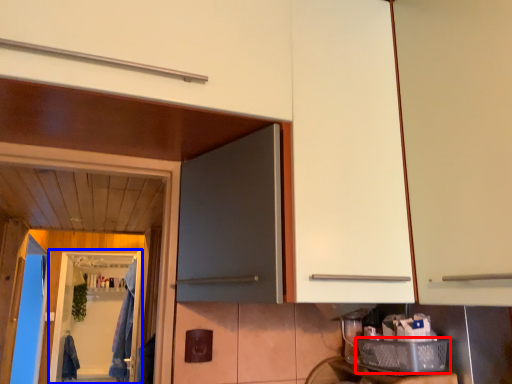
Question: Which object appears farthest to the camera in this image, basket (highlighted by a red box) or screen door (highlighted by a blue box)?

Choices:
 (A) basket
 (B) screen door

Answer: (B)